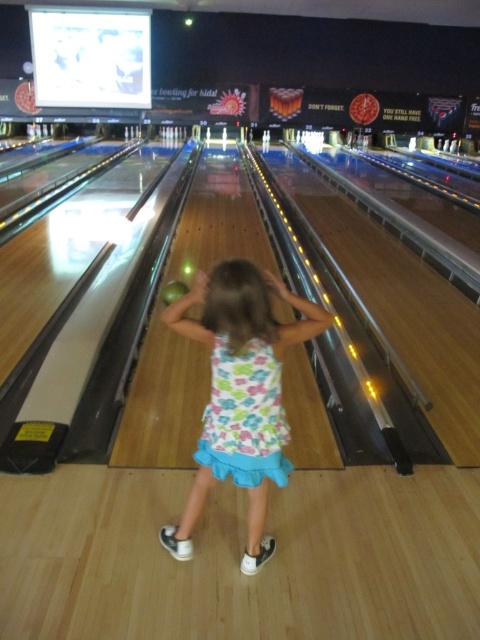
Question: Is white floral dress at center to the left of matte yellow bowling ball at center from the viewer's perspective?

Choices:
 (A) yes
 (B) no

Answer: (B)

Question: Which of the following is the closest to the observer?

Choices:
 (A) (178, 284)
 (B) (213, 388)

Answer: (B)

Question: Can you confirm if floral cotton dress at center is bigger than matte yellow bowling ball at center?

Choices:
 (A) no
 (B) yes

Answer: (A)

Question: Based on their relative distances, which object is nearer to the matte yellow bowling ball at center?

Choices:
 (A) floral cotton dress at center
 (B) white floral dress at center

Answer: (B)

Question: Which is nearer to the matte yellow bowling ball at center?

Choices:
 (A) white floral dress at center
 (B) floral cotton dress at center

Answer: (A)

Question: Is white floral dress at center below matte yellow bowling ball at center?

Choices:
 (A) yes
 (B) no

Answer: (A)